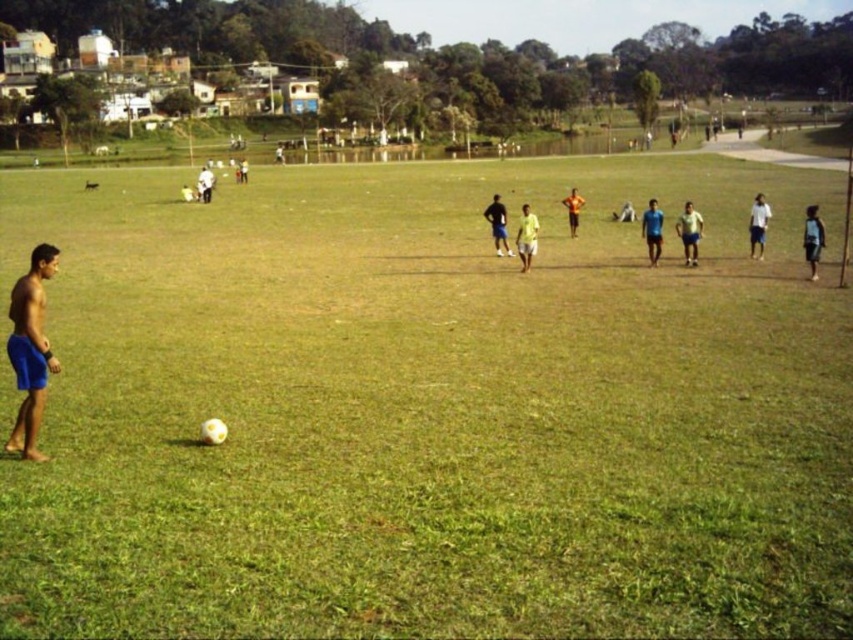
Is point (759, 253) closer to viewer compared to point (572, 212)?

Yes, point (759, 253) is in front of point (572, 212).

Does white matte shirt at right have a larger size compared to light brown skin at center?

Yes.

Does point (751, 234) come in front of point (573, 204)?

Yes, it is.

You are a GUI agent. You are given a task and a screenshot of the screen. Output one action in this format:
    pyautogui.click(x=<x>, y=<y>)
    Task: Click on the white matte shirt at right
    This screenshot has width=853, height=640.
    Given the screenshot: What is the action you would take?
    pyautogui.click(x=758, y=225)

Who is positioned more to the left, yellow fabric shirt at center or dark blue shorts at center?

Positioned to the left is dark blue shorts at center.

Is point (531, 243) closer to camera compared to point (498, 237)?

Yes, it is in front of point (498, 237).

Locate an element on the screen. This screenshot has width=853, height=640. yellow fabric shirt at center is located at coordinates point(526,237).

Between blue fabric shorts at left and blue shorts at center, which one has more height?

Standing taller between the two is blue fabric shorts at left.

Is blue fabric shorts at left to the right of blue shorts at center from the viewer's perspective?

No, blue fabric shorts at left is not to the right of blue shorts at center.

Who is more forward, (16, 435) or (688, 266)?

Point (16, 435) is in front.

Where is `blue fabric shorts at left`? This screenshot has height=640, width=853. blue fabric shorts at left is located at coordinates (30, 349).